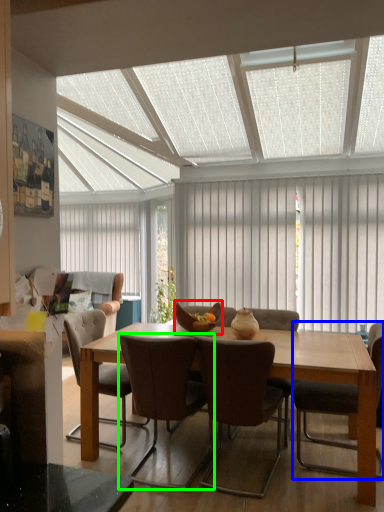
Question: Which is nearer to the bowl (highlighted by a red box)? chair (highlighted by a blue box) or chair (highlighted by a green box).

Choices:
 (A) chair
 (B) chair

Answer: (B)